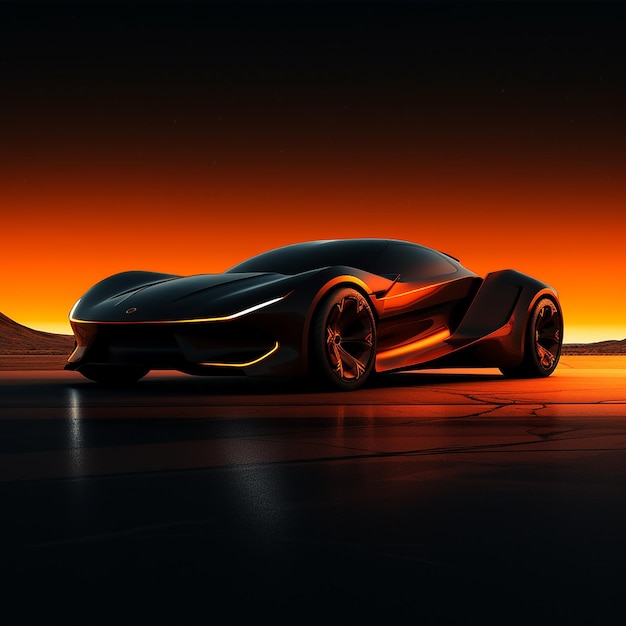
Locate an element on the screen. window is located at coordinates click(x=407, y=262).